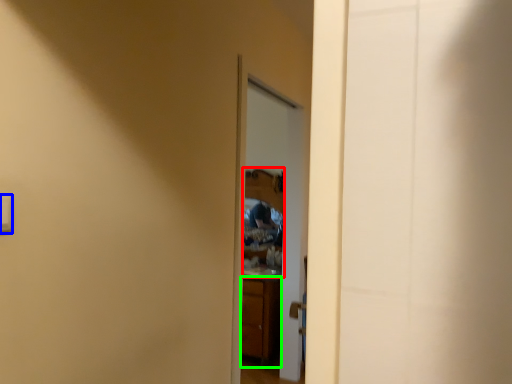
Question: Which object is positioned farthest from mirror (highlighted by a red box)? Select from light switch (highlighted by a blue box) and cabinetry (highlighted by a green box).

Choices:
 (A) light switch
 (B) cabinetry

Answer: (A)